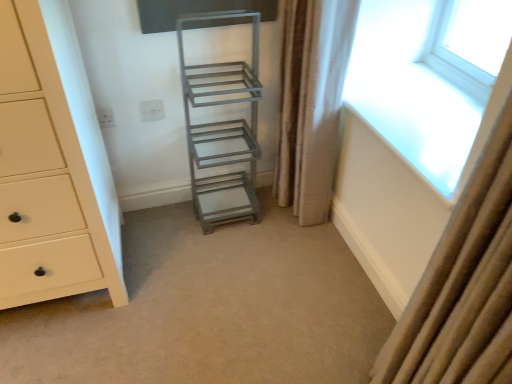
At what (x,y) coordinates should I click in order to perform the action: click on vacant space underneath metallic gray shelf at center (from a real-world perspective). Please return your answer as a coordinate pair (x, y). Looking at the image, I should click on (238, 204).